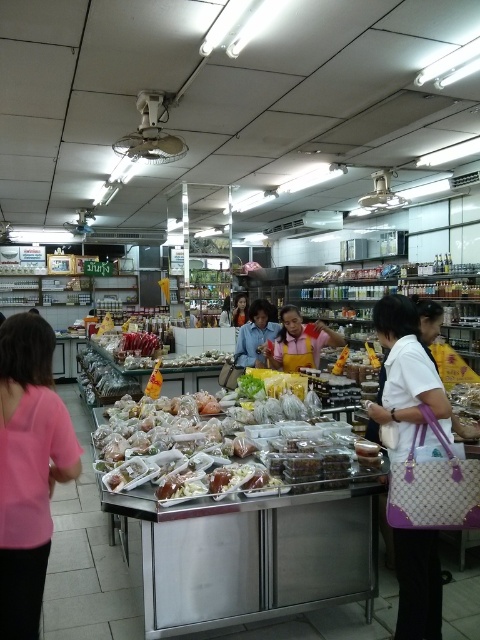
Question: Can you confirm if white fabric handbag at center-right is bigger than yellow fabric shirt at center?

Choices:
 (A) yes
 (B) no

Answer: (B)

Question: Which of the following is the farthest from the observer?

Choices:
 (A) translucent plastic containers at center
 (B) yellow fabric shirt at center
 (C) white fabric handbag at center-right

Answer: (B)

Question: Observing the image, what is the correct spatial positioning of yellow fabric apron at center in reference to yellow fabric shirt at center?

Choices:
 (A) right
 (B) left

Answer: (A)

Question: Is pink fabric shirt at left to the right of yellow fabric shirt at center from the viewer's perspective?

Choices:
 (A) yes
 (B) no

Answer: (B)

Question: Which of the following is the farthest from the observer?

Choices:
 (A) (236, 298)
 (B) (316, 326)
 (C) (63, 412)

Answer: (A)

Question: Which object appears closest to the camera in this image?

Choices:
 (A) blue fabric shirt at center
 (B) white fabric handbag at center-right

Answer: (B)